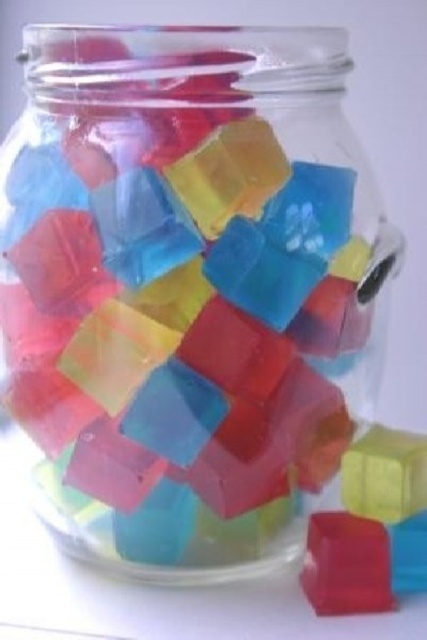
Question: Can you confirm if translucent plastic cube at center is positioned below translucent rubber cube at lower right?

Choices:
 (A) yes
 (B) no

Answer: (B)

Question: Can you confirm if translucent plastic cube at center is wider than translucent rubber cube at lower right?

Choices:
 (A) yes
 (B) no

Answer: (A)

Question: Which point is closer to the camera?

Choices:
 (A) (362, 515)
 (B) (315, 520)

Answer: (A)

Question: Does translucent plastic cube at center appear under translucent rubber cube at lower right?

Choices:
 (A) no
 (B) yes

Answer: (A)

Question: Which point appears closest to the camera in this image?

Choices:
 (A) (332, 547)
 (B) (359, 524)

Answer: (A)